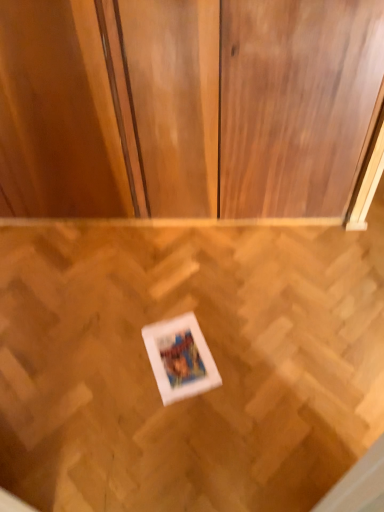
In order to click on empty space that is to the right of white matte picture frame at center in this screenshot , I will do `click(238, 349)`.